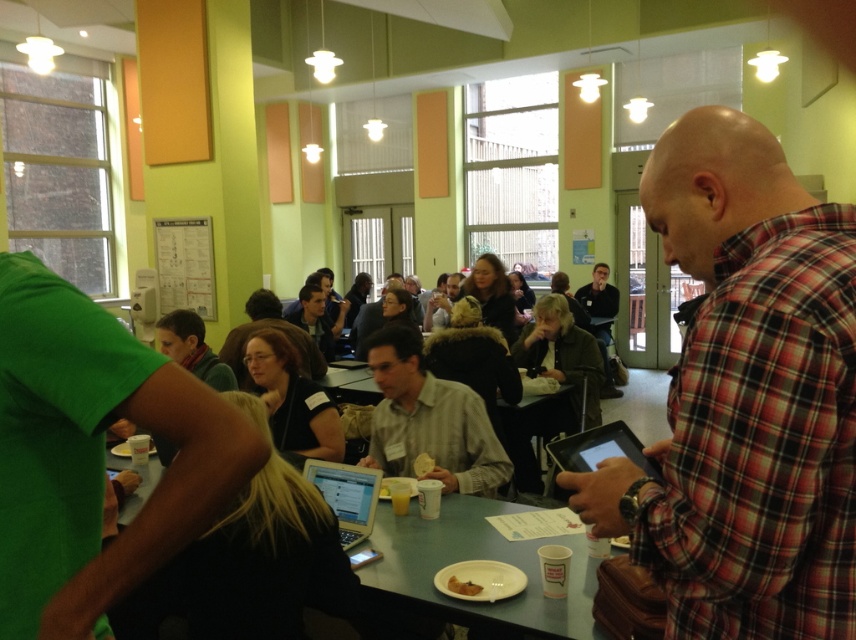
Question: Estimate the real-world distances between objects in this image. Which object is closer to the plaid fabric shirt at right?

Choices:
 (A) silver metallic laptop at center
 (B) green plastic table at center
 (C) green fabric shirt at left
 (D) yellow matte bread at center

Answer: (C)

Question: Which point is closer to the camera?

Choices:
 (A) (470, 580)
 (B) (367, 509)
 (C) (418, 525)

Answer: (A)

Question: Which of these objects is positioned closest to the green fabric shirt at left?

Choices:
 (A) yellow matte bread at center
 (B) green plastic table at center

Answer: (B)

Question: Is green plastic table at center further to the viewer compared to matte black shirt at center?

Choices:
 (A) yes
 (B) no

Answer: (B)

Question: Does plaid fabric shirt at right lie behind green fabric shirt at left?

Choices:
 (A) no
 (B) yes

Answer: (A)

Question: Does silver metallic laptop at center have a lesser width compared to brown crumbly bread at lower center?

Choices:
 (A) no
 (B) yes

Answer: (A)